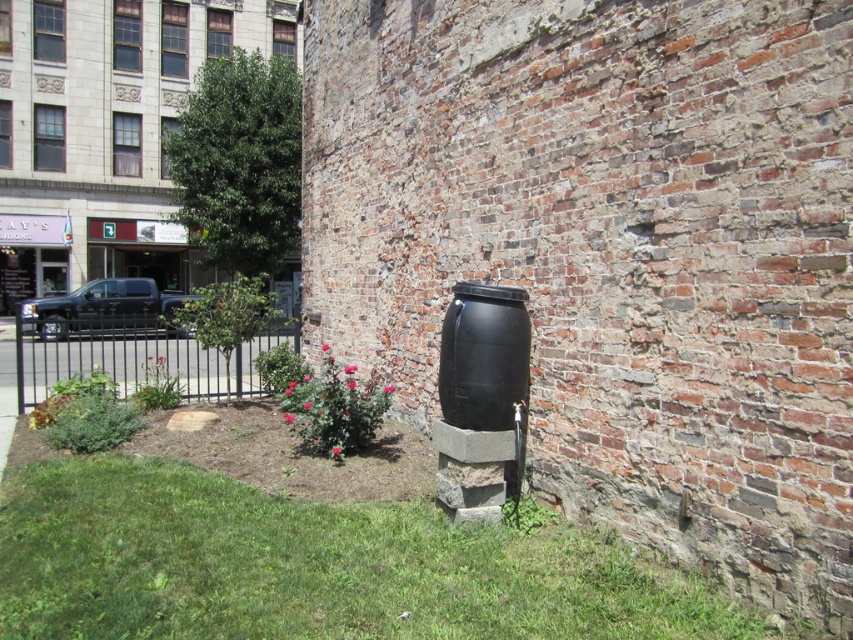
Question: Observing the image, what is the correct spatial positioning of green grass at lower center in reference to black metal fence at lower left?

Choices:
 (A) left
 (B) right

Answer: (B)

Question: Can you confirm if green grass at lower center is positioned to the left of black metal fence at lower left?

Choices:
 (A) no
 (B) yes

Answer: (A)

Question: Can you confirm if green grass at lower center is positioned below black metal fence at lower left?

Choices:
 (A) no
 (B) yes

Answer: (B)

Question: Which of the following is the closest to the observer?

Choices:
 (A) green grass at lower center
 (B) black metal fence at lower left

Answer: (A)